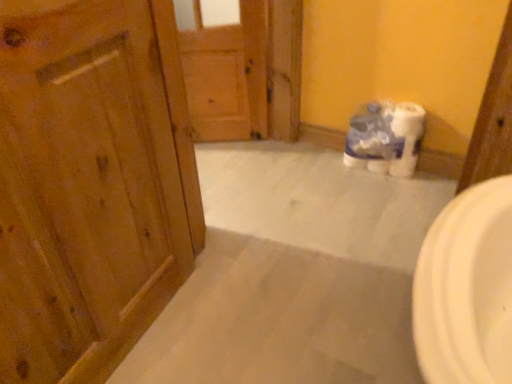
Locate an element on the screen. The height and width of the screenshot is (384, 512). wooden door at center, which ranks as the first door in back-to-front order is located at coordinates (227, 76).

What do you see at coordinates (89, 183) in the screenshot? Image resolution: width=512 pixels, height=384 pixels. I see `wooden door at left, which is counted as the 2th door, starting from the back` at bounding box center [89, 183].

At what (x,y) coordinates should I click in order to perform the action: click on white plastic toilet paper at center. Please return your answer as a coordinate pair (x, y). The width and height of the screenshot is (512, 384). Looking at the image, I should click on (386, 138).

Relative to wooden door at left, which is counted as the 2th door, starting from the back, is wooden door at center, the 2th door viewed from the front, in front or behind?

wooden door at center, the 2th door viewed from the front, is behind wooden door at left, which is counted as the 2th door, starting from the back.

Considering the sizes of wooden door at center, the 2th door viewed from the front, and wooden door at left, which is counted as the 2th door, starting from the back, in the image, is wooden door at center, the 2th door viewed from the front, wider or thinner than wooden door at left, which is counted as the 2th door, starting from the back,?

Considering their sizes, wooden door at center, the 2th door viewed from the front, looks slimmer than wooden door at left, which is counted as the 2th door, starting from the back.

From a real-world perspective, is wooden door at center, the 2th door viewed from the front, positioned over wooden door at left, which is counted as the 2th door, starting from the back, based on gravity?

No, from a real-world perspective, wooden door at center, the 2th door viewed from the front, is not over wooden door at left, which is counted as the 2th door, starting from the back

Is wooden door at center, the 2th door viewed from the front, looking in the opposite direction of wooden door at left, which is counted as the 2th door, starting from the back?

No, wooden door at center, the 2th door viewed from the front,'s orientation is not away from wooden door at left, which is counted as the 2th door, starting from the back.

Would you consider wooden door at left, which is counted as the 2th door, starting from the back, to be distant from wooden door at center, which ranks as the first door in back-to-front order?

wooden door at left, which is counted as the 2th door, starting from the back, is near wooden door at center, which ranks as the first door in back-to-front order, not far away.

Which object is positioned more to the left, wooden door at left, the 1th door positioned from the front, or wooden door at center, the 2th door viewed from the front?

wooden door at left, the 1th door positioned from the front.

Consider the image. From a real-world perspective, which is physically above, wooden door at left, the 1th door positioned from the front, or wooden door at center, the 2th door viewed from the front?

wooden door at left, the 1th door positioned from the front.

Between wooden door at left, which is counted as the 2th door, starting from the back, and wooden door at center, the 2th door viewed from the front, which one has smaller size?

wooden door at center, the 2th door viewed from the front.

Is white plastic toilet paper at center beside wooden door at left, the 1th door positioned from the front?

white plastic toilet paper at center and wooden door at left, the 1th door positioned from the front, are not in contact.

Does white plastic toilet paper at center turn towards wooden door at left, which is counted as the 2th door, starting from the back?

Yes, white plastic toilet paper at center is aimed at wooden door at left, which is counted as the 2th door, starting from the back.

How different are the orientations of white plastic toilet paper at center and wooden door at left, which is counted as the 2th door, starting from the back, in degrees?

The facing directions of white plastic toilet paper at center and wooden door at left, which is counted as the 2th door, starting from the back, are 94.7 degrees apart.

Consider the image. Considering the sizes of objects white plastic toilet paper at center and wooden door at left, the 1th door positioned from the front, in the image provided, who is taller, white plastic toilet paper at center or wooden door at left, the 1th door positioned from the front,?

With more height is wooden door at left, the 1th door positioned from the front.

Is wooden door at left, the 1th door positioned from the front, not within white plastic toilet paper at center?

Indeed, wooden door at left, the 1th door positioned from the front, is completely outside white plastic toilet paper at center.

Is wooden door at left, which is counted as the 2th door, starting from the back, with white plastic toilet paper at center?

wooden door at left, which is counted as the 2th door, starting from the back, and white plastic toilet paper at center are not in contact.

The image size is (512, 384). I want to click on toilet paper below the wooden door at left, which is counted as the 2th door, starting from the back (from a real-world perspective), so click(x=386, y=138).

From the image's perspective, which object appears higher, wooden door at left, the 1th door positioned from the front, or white plastic toilet paper at center?

white plastic toilet paper at center, from the image's perspective.

Is white plastic toilet paper at center shorter than wooden door at center, which ranks as the first door in back-to-front order?

Correct, white plastic toilet paper at center is not as tall as wooden door at center, which ranks as the first door in back-to-front order.

Which is more to the left, white plastic toilet paper at center or wooden door at center, which ranks as the first door in back-to-front order?

From the viewer's perspective, wooden door at center, which ranks as the first door in back-to-front order, appears more on the left side.

In terms of width, does white plastic toilet paper at center look wider or thinner when compared to wooden door at center, the 2th door viewed from the front?

Considering their sizes, white plastic toilet paper at center looks broader than wooden door at center, the 2th door viewed from the front.

From a real-world perspective, which is physically below, white plastic toilet paper at center or wooden door at center, which ranks as the first door in back-to-front order?

white plastic toilet paper at center.

Looking at this image, from a real-world perspective, which object rests below the other?

white plastic toilet paper at center is physically lower.

Which of these two, wooden door at center, the 2th door viewed from the front, or white plastic toilet paper at center, is smaller?

wooden door at center, the 2th door viewed from the front, is smaller.

Is wooden door at center, which ranks as the first door in back-to-front order, in front of white plastic toilet paper at center?

No, wooden door at center, which ranks as the first door in back-to-front order, is behind white plastic toilet paper at center.

Is point (220, 92) more distant than point (368, 120)?

Yes, it is.

At what (x,y) coordinates should I click in order to perform the action: click on door located underneath the wooden door at left, the 1th door positioned from the front (from a real-world perspective). Please return your answer as a coordinate pair (x, y). Looking at the image, I should click on (227, 76).

Where is `door on the left of wooden door at center, which ranks as the first door in back-to-front order`? door on the left of wooden door at center, which ranks as the first door in back-to-front order is located at coordinates (89, 183).

When comparing their distances from wooden door at left, the 1th door positioned from the front, does wooden door at center, the 2th door viewed from the front, or white plastic toilet paper at center seem further?

white plastic toilet paper at center is positioned further to the anchor wooden door at left, the 1th door positioned from the front.

When comparing their distances from white plastic toilet paper at center, does wooden door at left, the 1th door positioned from the front, or wooden door at center, the 2th door viewed from the front, seem closer?

wooden door at center, the 2th door viewed from the front, is closer to white plastic toilet paper at center.

Estimate the real-world distances between objects in this image. Which object is closer to wooden door at center, the 2th door viewed from the front, wooden door at left, which is counted as the 2th door, starting from the back, or white plastic toilet paper at center?

white plastic toilet paper at center is closer to wooden door at center, the 2th door viewed from the front.

Considering their positions, is wooden door at center, which ranks as the first door in back-to-front order, positioned closer to white plastic toilet paper at center than wooden door at left, which is counted as the 2th door, starting from the back?

Based on the image, wooden door at center, which ranks as the first door in back-to-front order, appears to be nearer to white plastic toilet paper at center.

Which object lies nearer to the anchor point wooden door at center, which ranks as the first door in back-to-front order, white plastic toilet paper at center or wooden door at left, which is counted as the 2th door, starting from the back?

white plastic toilet paper at center.

From the image, which object appears to be farther from wooden door at left, which is counted as the 2th door, starting from the back, white plastic toilet paper at center or wooden door at center, which ranks as the first door in back-to-front order?

white plastic toilet paper at center lies further to wooden door at left, which is counted as the 2th door, starting from the back, than the other object.

What are the coordinates of `toilet paper located between wooden door at left, which is counted as the 2th door, starting from the back, and wooden door at center, which ranks as the first door in back-to-front order, in the depth direction` in the screenshot? It's located at (386, 138).